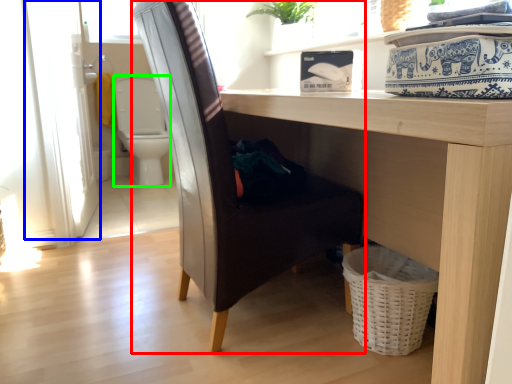
Question: Estimate the real-world distances between objects in this image. Which object is closer to chair (highlighted by a red box), screen door (highlighted by a blue box) or swivel chair (highlighted by a green box)?

Choices:
 (A) screen door
 (B) swivel chair

Answer: (A)